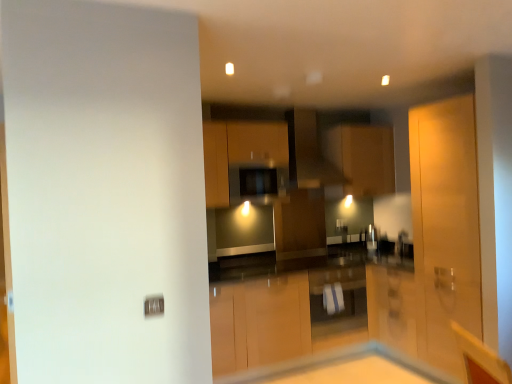
Question: Is white glossy table at center inside the boundaries of white glossy cabinet at center, which appears as the 2th cabinetry when viewed from the left, or outside?

Choices:
 (A) inside
 (B) outside

Answer: (B)

Question: Considering the positions of white glossy table at center and white glossy cabinet at center, which appears as the 2th cabinetry when viewed from the left, in the image, is white glossy table at center taller or shorter than white glossy cabinet at center, which appears as the 2th cabinetry when viewed from the left,?

Choices:
 (A) short
 (B) tall

Answer: (A)

Question: Estimate the real-world distances between objects in this image. Which object is closer to the white glossy table at center?

Choices:
 (A) matte wood cabinet at center, which is counted as the third cabinetry, starting from the bottom
 (B) matte wood screen door at right
 (C) white glossy cabinet at center, arranged as the 3th cabinetry when viewed from the top
 (D) matte wood cabinet at center, arranged as the 2th cabinetry when ordered from the bottom
 (E) matte black exhaust hood at center

Answer: (C)

Question: Estimate the real-world distances between objects in this image. Which object is closer to the matte wood screen door at right?

Choices:
 (A) white glossy table at center
 (B) white glossy cabinet at center, acting as the second cabinetry starting from the right
 (C) matte wood cabinet at center, the 3th cabinetry from the right
 (D) matte wood cabinet at center, which is counted as the third cabinetry, starting from the bottom
 (E) matte black exhaust hood at center

Answer: (A)